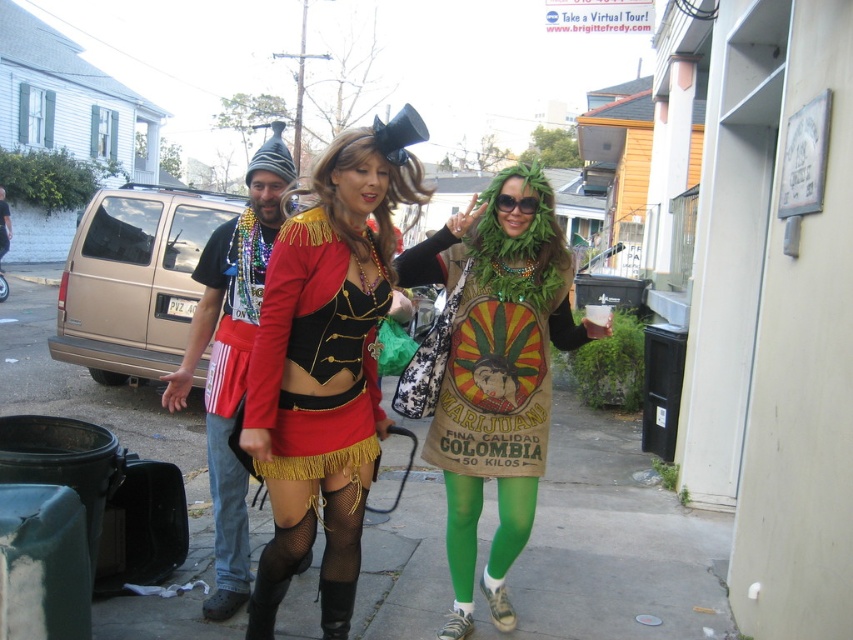
You are a photographer trying to capture a photo of the shiny red fabric dress at center and the jeans at lower left. Based on their positions, which object is located to the right of the other?

The shiny red fabric dress at center is positioned on the right side of jeans at lower left.